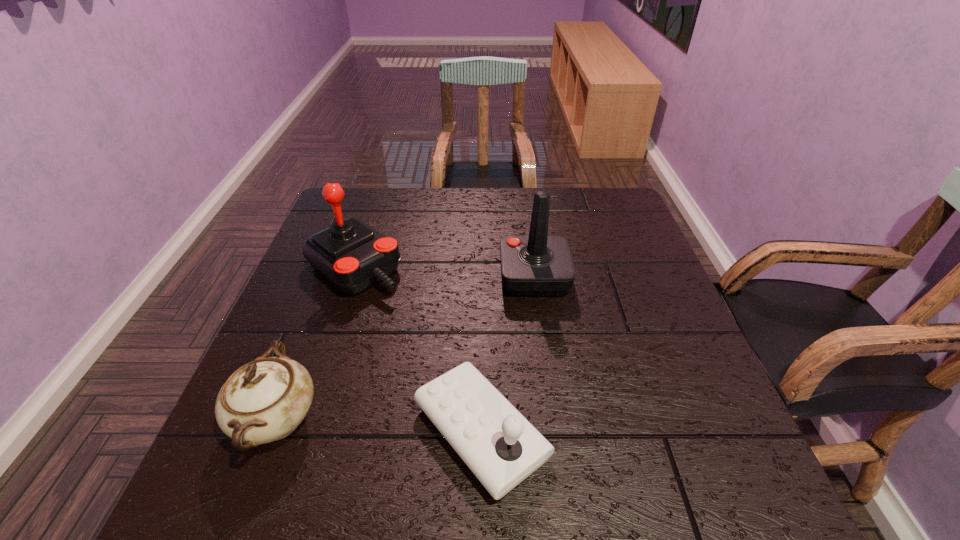
Where is `vacant area that lies between the leftmost joystick and the shortest joystick`? The width and height of the screenshot is (960, 540). vacant area that lies between the leftmost joystick and the shortest joystick is located at coordinates (418, 349).

Identify which object is located as the third nearest to the chinaware. Please provide its 2D coordinates. Your answer should be formatted as a tuple, i.e. [(x, y)], where the tuple contains the x and y coordinates of a point satisfying the conditions above.

[(538, 264)]

Where is `object that is the third nearest to the leftmost joystick`? object that is the third nearest to the leftmost joystick is located at coordinates (538, 264).

What are the coordinates of `joystick that is the second closest to the shortest object` in the screenshot? It's located at (351, 255).

Identify the location of joystick that is the second closest to the leftmost joystick. This screenshot has width=960, height=540. (538, 264).

What are the coordinates of `free space that satisfies the following two spatial constraints: 1. on the front side of the nearest joystick; 2. on the left side of the third tallest object` in the screenshot? It's located at (273, 432).

Where is `free point that satisfies the following two spatial constraints: 1. on the front side of the leftmost joystick; 2. on the left side of the nearest joystick`? Image resolution: width=960 pixels, height=540 pixels. free point that satisfies the following two spatial constraints: 1. on the front side of the leftmost joystick; 2. on the left side of the nearest joystick is located at coordinates (300, 432).